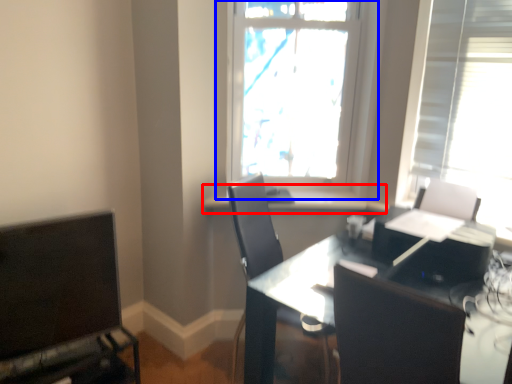
Question: Which object appears closest to the camera in this image, window sill (highlighted by a red box) or window (highlighted by a blue box)?

Choices:
 (A) window sill
 (B) window

Answer: (B)